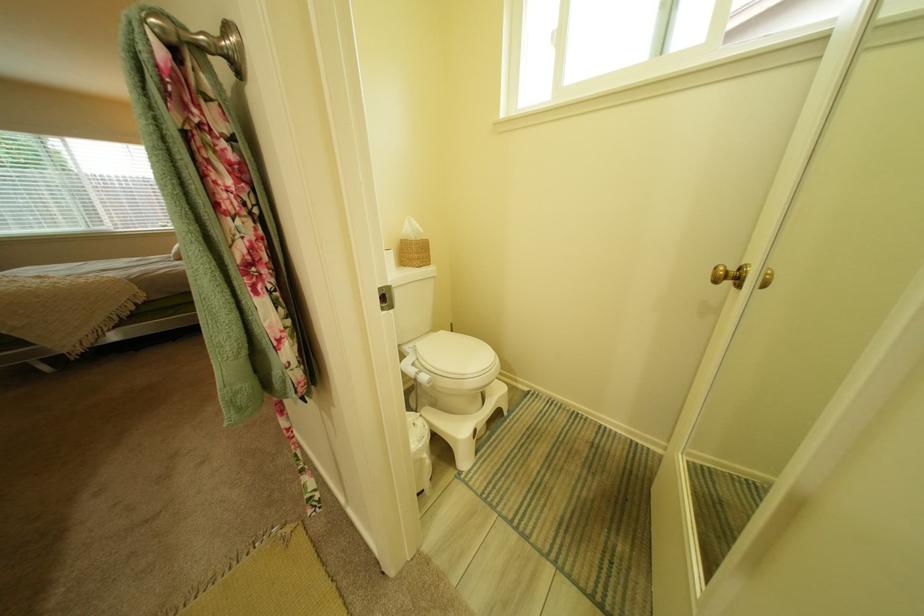
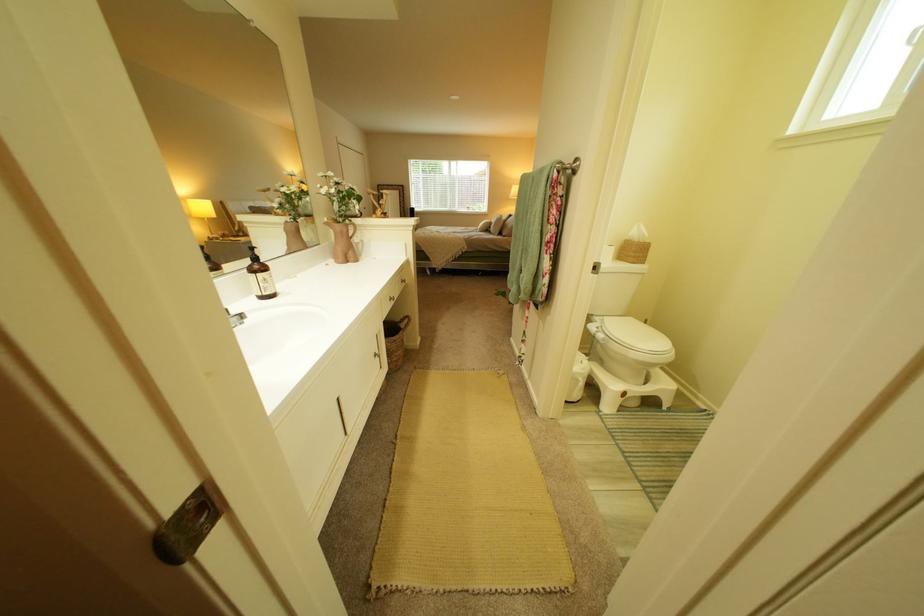
Question: The camera is either moving clockwise (left) or counter-clockwise (right) around the object. The first image is from the beginning of the video and the second image is from the end. Is the camera moving left or right when shooting the video?

Choices:
 (A) Left
 (B) Right

Answer: (B)